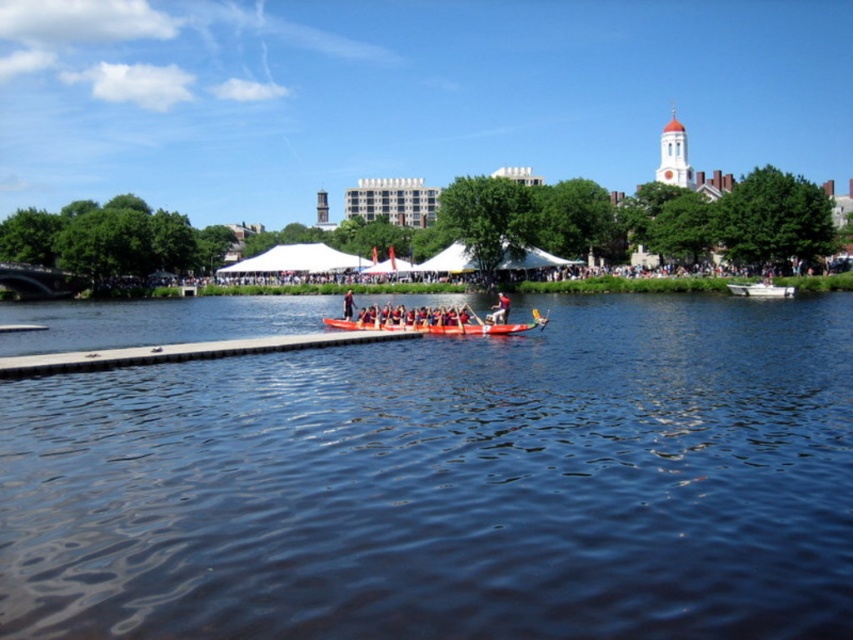
Who is higher up, orange glossy canoe at center or smooth red boat at center?

orange glossy canoe at center is above.

This screenshot has height=640, width=853. I want to click on orange glossy canoe at center, so click(433, 321).

Who is lower down, orange glossy canoe at center or wooden paddle at center?

Positioned lower is orange glossy canoe at center.

Does orange glossy canoe at center appear on the left side of wooden paddle at center?

Indeed, orange glossy canoe at center is positioned on the left side of wooden paddle at center.

This screenshot has height=640, width=853. I want to click on orange glossy canoe at center, so click(x=433, y=321).

Who is more forward, (175, 605) or (381, 323)?

Point (175, 605) is more forward.

What do you see at coordinates (450, 483) in the screenshot?
I see `dark blue water at center` at bounding box center [450, 483].

The height and width of the screenshot is (640, 853). I want to click on dark blue water at center, so click(450, 483).